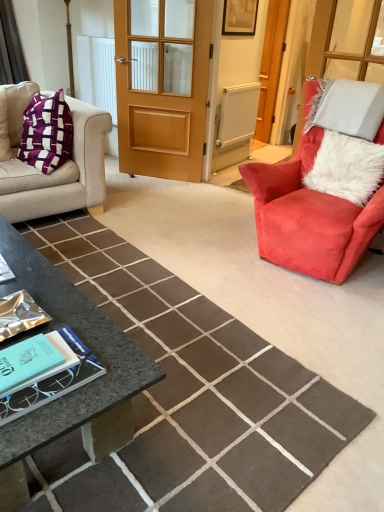
Where is `granite coffee table at lower left`? This screenshot has width=384, height=512. granite coffee table at lower left is located at coordinates (79, 388).

The image size is (384, 512). What do you see at coordinates (79, 388) in the screenshot?
I see `granite coffee table at lower left` at bounding box center [79, 388].

What do you see at coordinates (60, 172) in the screenshot?
I see `velvet beige couch at left` at bounding box center [60, 172].

This screenshot has width=384, height=512. Identify the location of white fluffy pillow at right. (346, 168).

Find the location of a particular element. This screenshot has height=512, width=384. granite coffee table at lower left is located at coordinates (79, 388).

Considering the positions of objects white textured radiator at center and wooden door at center in the image provided, who is in front, white textured radiator at center or wooden door at center?

Positioned in front is wooden door at center.

From the image's perspective, between white textured radiator at center and wooden door at center, who is located below?

wooden door at center.

Identify the location of radiator located underneath the wooden door at center (from a real-world perspective). (238, 114).

Could you tell me if white textured radiator at center is turned towards wooden door at center?

No.

Does velvet red armchair at right have a lesser height compared to white textured radiator at center?

In fact, velvet red armchair at right may be taller than white textured radiator at center.

Which of these two, velvet red armchair at right or white textured radiator at center, is bigger?

With larger size is velvet red armchair at right.

Does velvet red armchair at right appear on the left side of white textured radiator at center?

In fact, velvet red armchair at right is to the right of white textured radiator at center.

In the scene shown: From their relative heights in the image, would you say granite coffee table at lower left is taller or shorter than wooden door at center?

In the image, granite coffee table at lower left appears to be shorter than wooden door at center.

Looking at this image, measure the distance between granite coffee table at lower left and wooden door at center.

granite coffee table at lower left is 2.26 meters from wooden door at center.

Considering the positions of objects granite coffee table at lower left and wooden door at center in the image provided, who is behind, granite coffee table at lower left or wooden door at center?

wooden door at center.

Based on their sizes in the image, would you say wooden picture frame at upper center is bigger or smaller than wooden door at center?

In the image, wooden picture frame at upper center appears to be smaller than wooden door at center.

Considering the sizes of objects wooden picture frame at upper center and wooden door at center in the image provided, who is thinner, wooden picture frame at upper center or wooden door at center?

With smaller width is wooden picture frame at upper center.

Is point (247, 34) closer to camera compared to point (119, 106)?

No, it is behind (119, 106).

How much distance is there between wooden picture frame at upper center and wooden door at center?

wooden picture frame at upper center is 26.99 inches away from wooden door at center.

Between white fluffy pillow at right and teal matte book at lower left, which one has larger size?

Bigger between the two is white fluffy pillow at right.

Can you tell me how much white fluffy pillow at right and teal matte book at lower left differ in facing direction?

They differ by 3.13 degrees in their facing directions.

Which of these two, white fluffy pillow at right or teal matte book at lower left, is thinner?

teal matte book at lower left is thinner.

Consider the image. Would you say white fluffy pillow at right is outside teal matte book at lower left?

white fluffy pillow at right is positioned outside teal matte book at lower left.

Is velvet red armchair at right facing away from white fluffy pillow at right?

That's right, velvet red armchair at right is facing away from white fluffy pillow at right.

From the image's perspective, which object appears higher, velvet red armchair at right or white fluffy pillow at right?

white fluffy pillow at right appears higher in the image.

Between wooden screen door at center and velvet red armchair at right, which one has smaller size?

wooden screen door at center is smaller.

Considering the relative positions of wooden screen door at center and velvet red armchair at right in the image provided, is wooden screen door at center to the left of velvet red armchair at right from the viewer's perspective?

Incorrect, wooden screen door at center is not on the left side of velvet red armchair at right.

In the image, is wooden screen door at center positioned in front of or behind velvet red armchair at right?

wooden screen door at center is positioned farther from the viewer than velvet red armchair at right.

I want to click on screen door above the velvet red armchair at right (from a real-world perspective), so click(x=271, y=66).

Identify the location of door above the white textured radiator at center (from a real-world perspective). This screenshot has height=512, width=384. (162, 85).

Identify the location of chair in front of the white textured radiator at center. (308, 222).

From the image, which object appears to be nearer to wooden door at center, velvet beige couch at left or velvet red armchair at right?

velvet beige couch at left.

When comparing their distances from granite coffee table at lower left, does wooden door at center or velvet red armchair at right seem further?

wooden door at center lies further to granite coffee table at lower left than the other object.

Which object lies further to the anchor point white fluffy pillow at right, wooden door at center or teal matte book at lower left?

teal matte book at lower left is positioned further to the anchor white fluffy pillow at right.

Estimate the real-world distances between objects in this image. Which object is closer to white fluffy pillow at right, wooden door at center or white textured radiator at center?

white textured radiator at center is positioned closer to the anchor white fluffy pillow at right.

Looking at the image, which one is located closer to white textured radiator at center, velvet beige couch at left or granite coffee table at lower left?

velvet beige couch at left.

Based on the photo, from the image, which object appears to be farther from white textured radiator at center, granite coffee table at lower left or teal matte book at lower left?

teal matte book at lower left is further to white textured radiator at center.

Considering their positions, is velvet red armchair at right positioned closer to wooden picture frame at upper center than white fluffy pillow at right?

Based on the image, white fluffy pillow at right appears to be nearer to wooden picture frame at upper center.

Which object lies nearer to the anchor point teal matte book at lower left, wooden door at center or velvet beige couch at left?

velvet beige couch at left lies closer to teal matte book at lower left than the other object.

Locate an element on the screen. Image resolution: width=384 pixels, height=512 pixels. picture frame between velvet beige couch at left and white fluffy pillow at right is located at coordinates (239, 17).

The width and height of the screenshot is (384, 512). Identify the location of studio couch positioned between teal matte book at lower left and wooden door at center from near to far. (60, 172).

At what (x,y) coordinates should I click in order to perform the action: click on pillow that lies between wooden picture frame at upper center and velvet red armchair at right from top to bottom. Please return your answer as a coordinate pair (x, y). This screenshot has width=384, height=512. Looking at the image, I should click on (346, 168).

This screenshot has height=512, width=384. In order to click on picture frame between white fluffy pillow at right and wooden screen door at center from front to back in this screenshot , I will do `click(239, 17)`.